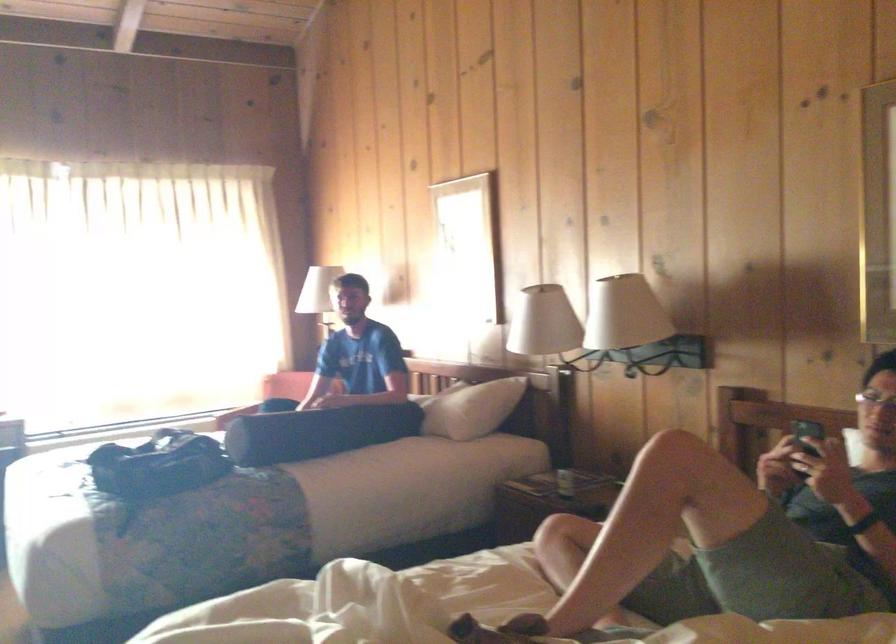
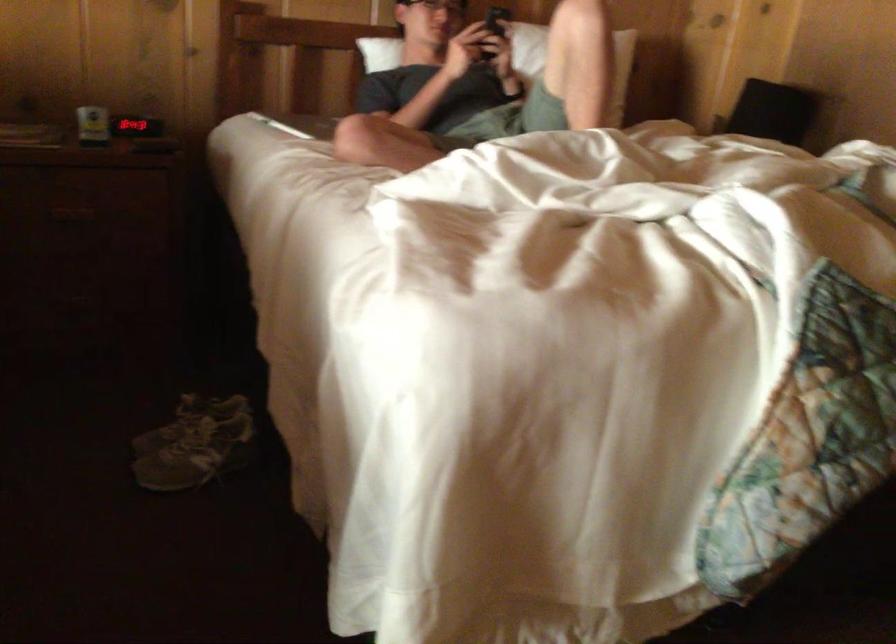
In the second image, find the point that corresponds to (x=798, y=444) in the first image.

(495, 24)